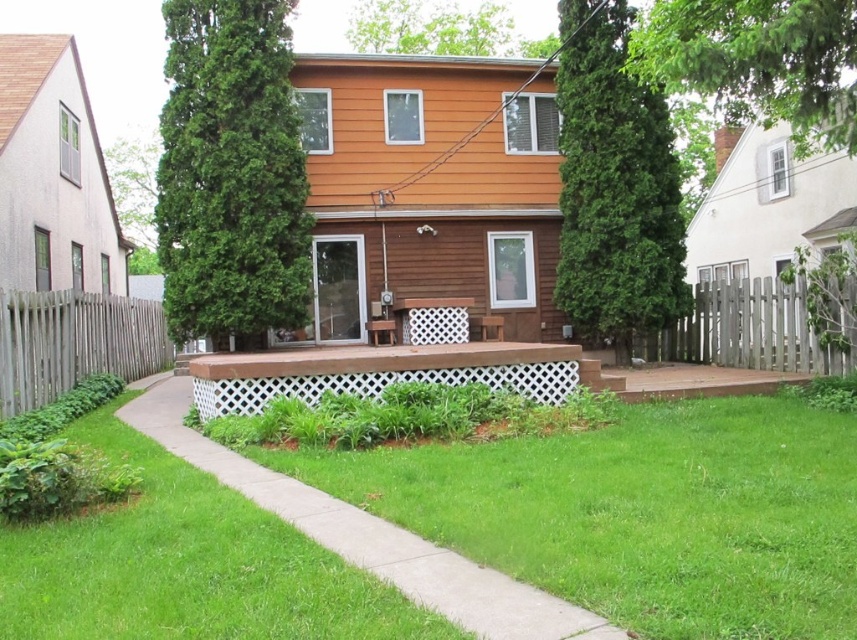
Question: Estimate the real-world distances between objects in this image. Which object is closer to the concrete at center?

Choices:
 (A) wooden picket fence at right
 (B) gray wood fence at left

Answer: (B)

Question: Can you confirm if wooden picket fence at right is bigger than gray wood fence at left?

Choices:
 (A) yes
 (B) no

Answer: (B)

Question: Does wooden picket fence at right appear on the right side of gray wood fence at left?

Choices:
 (A) no
 (B) yes

Answer: (B)

Question: Which object appears farthest from the camera in this image?

Choices:
 (A) gray wood fence at left
 (B) concrete at center

Answer: (A)

Question: Does concrete at center come in front of gray wood fence at left?

Choices:
 (A) no
 (B) yes

Answer: (B)

Question: Among these points, which one is nearest to the camera?

Choices:
 (A) (812, 346)
 (B) (346, 518)
 (C) (3, 404)

Answer: (B)